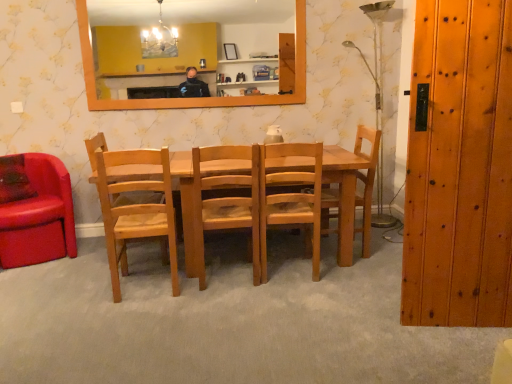
At what (x,y) coordinates should I click in order to perform the action: click on vacant region in front of wooden door at right. Please return your answer as a coordinate pair (x, y). This screenshot has width=512, height=384. Looking at the image, I should click on (462, 348).